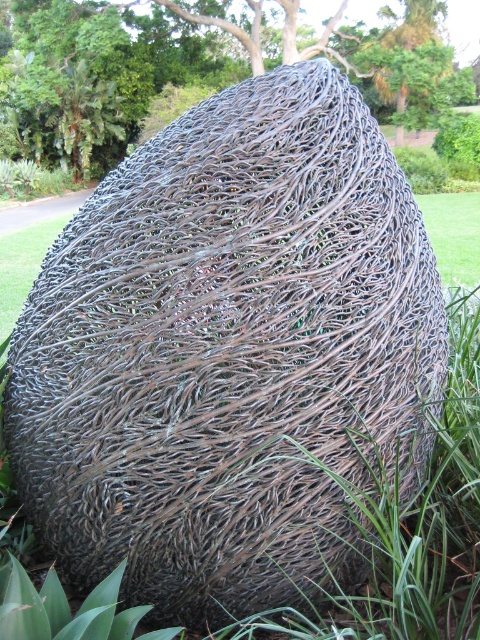
Is brown textured root at center to the right of green grass at center from the viewer's perspective?

No, brown textured root at center is not to the right of green grass at center.

Locate an element on the screen. brown textured root at center is located at coordinates (194, 68).